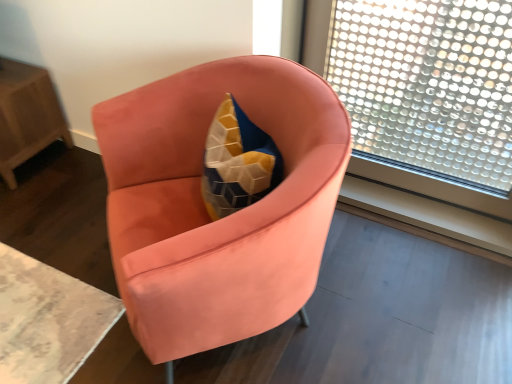
Question: Is transparent glass window at upper right wider than wooden table at left?

Choices:
 (A) yes
 (B) no

Answer: (B)

Question: Is transparent glass window at upper right oriented away from wooden table at left?

Choices:
 (A) yes
 (B) no

Answer: (B)

Question: Does transparent glass window at upper right lie in front of wooden table at left?

Choices:
 (A) no
 (B) yes

Answer: (B)

Question: Does transparent glass window at upper right come behind wooden table at left?

Choices:
 (A) yes
 (B) no

Answer: (B)

Question: From a real-world perspective, is transparent glass window at upper right under wooden table at left?

Choices:
 (A) no
 (B) yes

Answer: (A)

Question: Can you confirm if transparent glass window at upper right is positioned to the right of wooden table at left?

Choices:
 (A) no
 (B) yes

Answer: (B)

Question: Is transparent glass window at upper right at the left side of satin coral armchair at center?

Choices:
 (A) yes
 (B) no

Answer: (B)

Question: Can you confirm if transparent glass window at upper right is positioned to the right of satin coral armchair at center?

Choices:
 (A) no
 (B) yes

Answer: (B)

Question: Is transparent glass window at upper right facing away from satin coral armchair at center?

Choices:
 (A) yes
 (B) no

Answer: (B)

Question: Considering the relative sizes of transparent glass window at upper right and satin coral armchair at center in the image provided, is transparent glass window at upper right shorter than satin coral armchair at center?

Choices:
 (A) no
 (B) yes

Answer: (A)

Question: From a real-world perspective, is transparent glass window at upper right physically below satin coral armchair at center?

Choices:
 (A) no
 (B) yes

Answer: (A)

Question: Does transparent glass window at upper right have a lesser width compared to satin coral armchair at center?

Choices:
 (A) yes
 (B) no

Answer: (A)

Question: Would you say transparent glass window at upper right is part of satin coral armchair at center's contents?

Choices:
 (A) yes
 (B) no

Answer: (B)